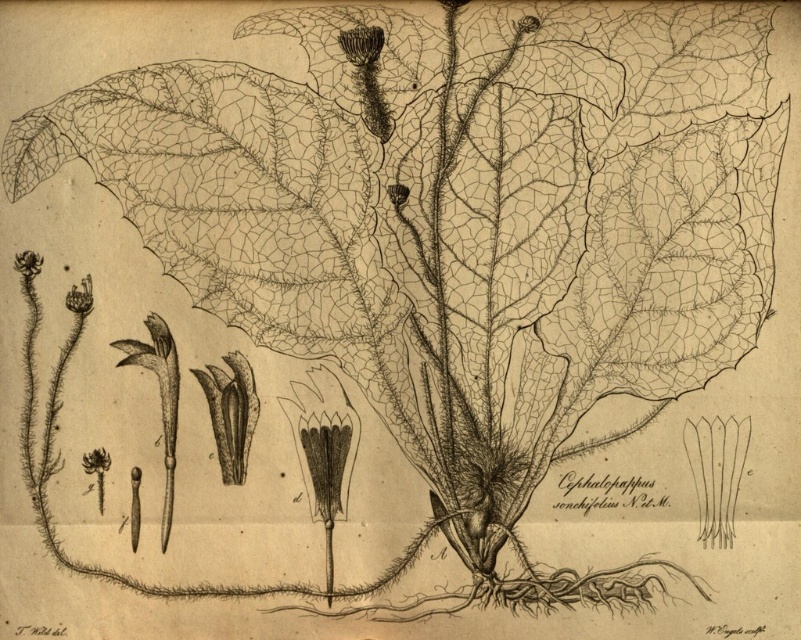
You are an artist trying to paint a still life of the matte black flower at upper left and the white paper flower at upper left. Which flower will you need to paint taller in your artwork?

The matte black flower at upper left is much taller than the white paper flower at upper left, so you should paint the matte black flower at upper left taller in your artwork.

You are an artist examining the botanical illustration of Cephalepappus sonchifolius N.Pet.M. You notice two flowers at the upper left corner of the image. Which flower is closer to the viewer, the matte black flower at upper left or the white paper flower at upper left?

The matte black flower at upper left is closer to the viewer because the white paper flower at upper left is positioned behind it.